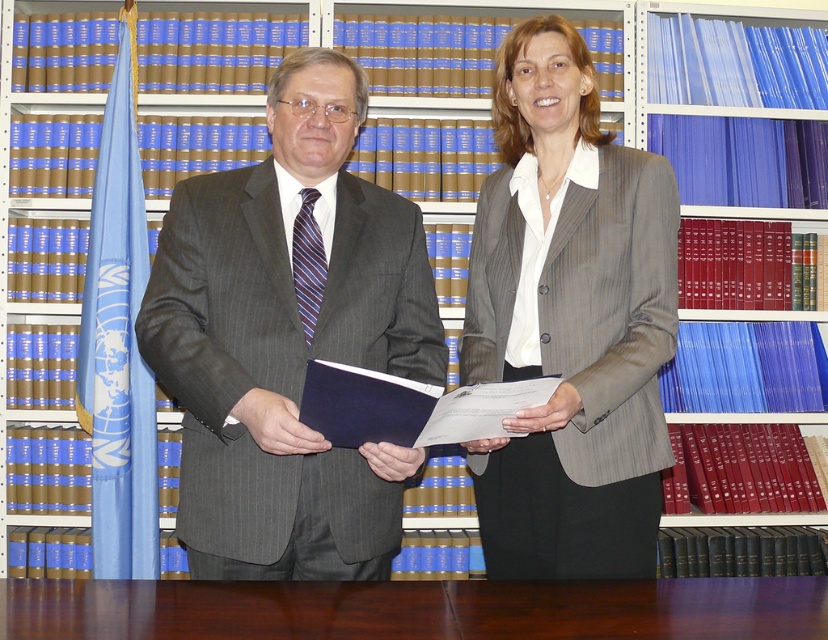
Image resolution: width=828 pixels, height=640 pixels. In order to click on matte gray suit at center in this screenshot , I will do `click(287, 339)`.

Is point (280, 244) more distant than point (326, 612)?

Yes, it is behind point (326, 612).

Who is more distant from viewer, (381, 234) or (474, 627)?

Point (381, 234)

Image resolution: width=828 pixels, height=640 pixels. I want to click on matte gray suit at center, so [x=287, y=339].

Can you confirm if gray pinstripe blazer at center is taller than brown wood table at center?

Correct, gray pinstripe blazer at center is much taller as brown wood table at center.

Between point (667, 328) and point (277, 605), which one is positioned behind?

The point (667, 328) is behind.

Is point (465, 444) more distant than point (209, 609)?

Yes, point (465, 444) is farther from viewer.

Where is `gray pinstripe blazer at center`? gray pinstripe blazer at center is located at coordinates (569, 321).

Who is positioned more to the right, matte gray suit at center or gray pinstripe blazer at center?

From the viewer's perspective, gray pinstripe blazer at center appears more on the right side.

Is matte gray suit at center below gray pinstripe blazer at center?

Yes, matte gray suit at center is below gray pinstripe blazer at center.

You are a GUI agent. You are given a task and a screenshot of the screen. Output one action in this format:
    pyautogui.click(x=<x>, y=<y>)
    Task: Click on the matte gray suit at center
    
    Given the screenshot: What is the action you would take?
    pyautogui.click(x=287, y=339)

At what (x,y) coordinates should I click in order to perform the action: click on matte gray suit at center. Please return your answer as a coordinate pair (x, y). The width and height of the screenshot is (828, 640). Looking at the image, I should click on (287, 339).